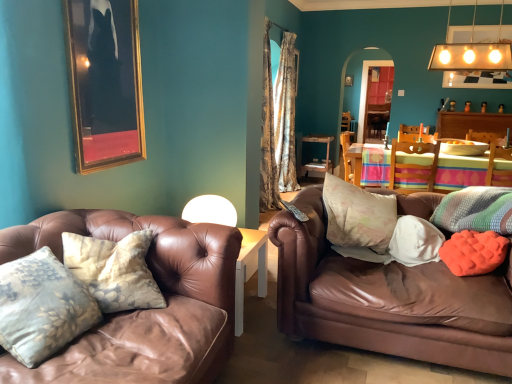
Question: Is wooden table at center, which is the first table in front-to-back order, closer to camera compared to brown leather couch at right?

Choices:
 (A) no
 (B) yes

Answer: (A)

Question: From the image's perspective, is wooden table at center, the second table viewed from the back, beneath brown leather couch at right?

Choices:
 (A) no
 (B) yes

Answer: (A)

Question: Considering the relative sizes of wooden table at center, the second table viewed from the back, and brown leather couch at right in the image provided, is wooden table at center, the second table viewed from the back, thinner than brown leather couch at right?

Choices:
 (A) yes
 (B) no

Answer: (A)

Question: Is wooden table at center, which is the first table in front-to-back order, facing towards brown leather couch at right?

Choices:
 (A) no
 (B) yes

Answer: (B)

Question: Considering the relative sizes of wooden table at center, which is the first table in front-to-back order, and brown leather couch at right in the image provided, is wooden table at center, which is the first table in front-to-back order, bigger than brown leather couch at right?

Choices:
 (A) no
 (B) yes

Answer: (A)

Question: From the image's perspective, is wooden table at center, the second table viewed from the back, positioned above or below wooden table at center, the first table viewed from the back?

Choices:
 (A) above
 (B) below

Answer: (B)

Question: Choose the correct answer: Is wooden table at center, the second table viewed from the back, inside wooden table at center, marked as the second table in a front-to-back arrangement, or outside it?

Choices:
 (A) inside
 (B) outside

Answer: (B)

Question: Considering the positions of wooden table at center, which is the first table in front-to-back order, and wooden table at center, the first table viewed from the back, in the image, is wooden table at center, which is the first table in front-to-back order, taller or shorter than wooden table at center, the first table viewed from the back,?

Choices:
 (A) short
 (B) tall

Answer: (A)

Question: From a real-world perspective, is wooden table at center, the second table viewed from the back, physically located above or below wooden table at center, the first table viewed from the back?

Choices:
 (A) above
 (B) below

Answer: (A)

Question: Is white fabric pillow at right, arranged as the 4th pillow when viewed from the front, bigger or smaller than orange fabric pillow at right, which is the 6th pillow from left to right?

Choices:
 (A) small
 (B) big

Answer: (A)

Question: From a real-world perspective, is white fabric pillow at right, which appears as the third pillow when viewed from the left, physically located above or below orange fabric pillow at right, the sixth pillow in the front-to-back sequence?

Choices:
 (A) below
 (B) above

Answer: (A)

Question: Is white fabric pillow at right, positioned as the third pillow in back-to-front order, inside or outside of orange fabric pillow at right, which is the 6th pillow from left to right?

Choices:
 (A) inside
 (B) outside

Answer: (B)

Question: From the image's perspective, is white fabric pillow at right, arranged as the 4th pillow when viewed from the front, above or below orange fabric pillow at right, acting as the 1th pillow starting from the right?

Choices:
 (A) below
 (B) above

Answer: (A)

Question: Does point (465, 152) appear closer or farther from the camera than point (98, 56)?

Choices:
 (A) farther
 (B) closer

Answer: (A)

Question: From a real-world perspective, is orange fabric pillow at right, acting as the 1th pillow starting from the right, above or below gold-framed picture at upper left?

Choices:
 (A) above
 (B) below

Answer: (B)